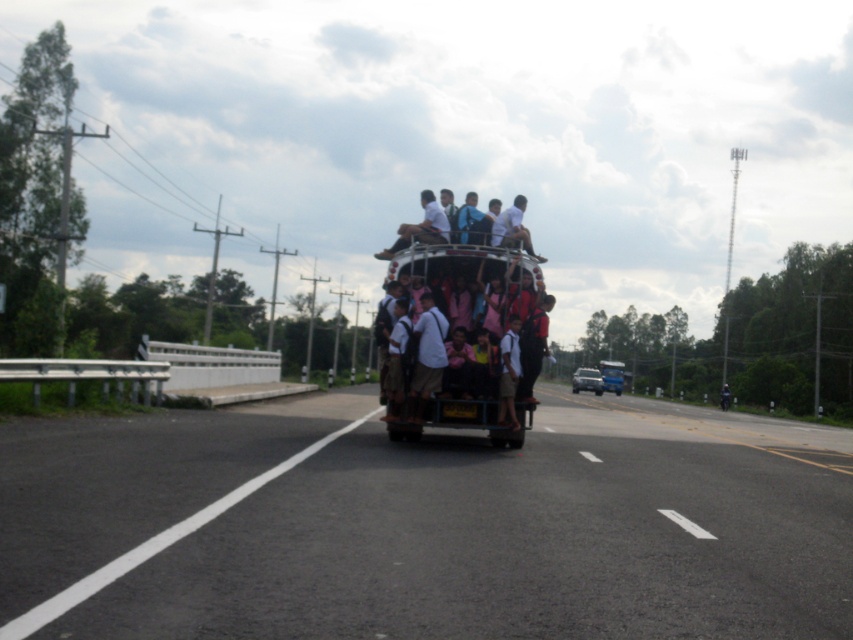
Question: Can you confirm if black asphalt road at center is bigger than light brown wooden bench at center?

Choices:
 (A) no
 (B) yes

Answer: (B)

Question: Which point is closer to the camera taking this photo?

Choices:
 (A) (421, 257)
 (B) (630, 595)
 (C) (582, 374)

Answer: (B)

Question: Which of these objects is positioned farthest from the black asphalt road at center?

Choices:
 (A) blue metallic truck at center
 (B) metallic silver truck at center
 (C) light brown wooden bench at center

Answer: (A)

Question: Among these points, which one is nearest to the camera?

Choices:
 (A) (602, 387)
 (B) (473, 426)
 (C) (599, 385)

Answer: (B)

Question: Is light brown wooden bench at center to the right of metallic silver truck at center from the viewer's perspective?

Choices:
 (A) no
 (B) yes

Answer: (A)

Question: Is light brown wooden bench at center closer to camera compared to metallic silver truck at center?

Choices:
 (A) yes
 (B) no

Answer: (A)